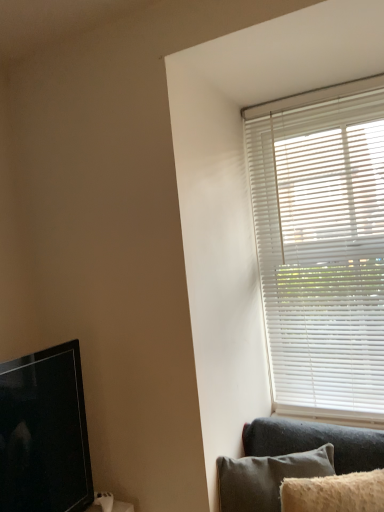
Question: Does point (352, 280) appear closer or farther from the camera than point (314, 478)?

Choices:
 (A) farther
 (B) closer

Answer: (A)

Question: Looking at the image, does white matte blinds at upper right seem bigger or smaller compared to fuzzy beige pillow at lower right?

Choices:
 (A) small
 (B) big

Answer: (B)

Question: Considering the real-world distances, which object is closest to the black glossy tv at left?

Choices:
 (A) white matte blinds at upper right
 (B) fuzzy beige pillow at lower right
 (C) dark gray fabric couch at lower right

Answer: (C)

Question: Which is nearer to the fuzzy beige pillow at lower right?

Choices:
 (A) dark gray fabric couch at lower right
 (B) black glossy tv at left
 (C) white matte blinds at upper right

Answer: (A)